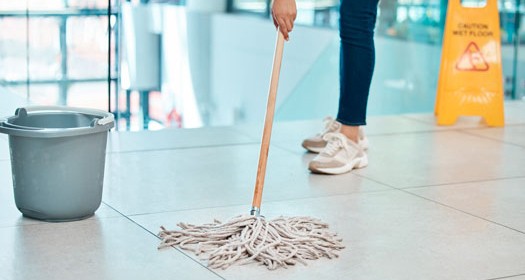
This screenshot has width=525, height=280. What are the coordinates of `string mop` in the screenshot? It's located at (242, 245).